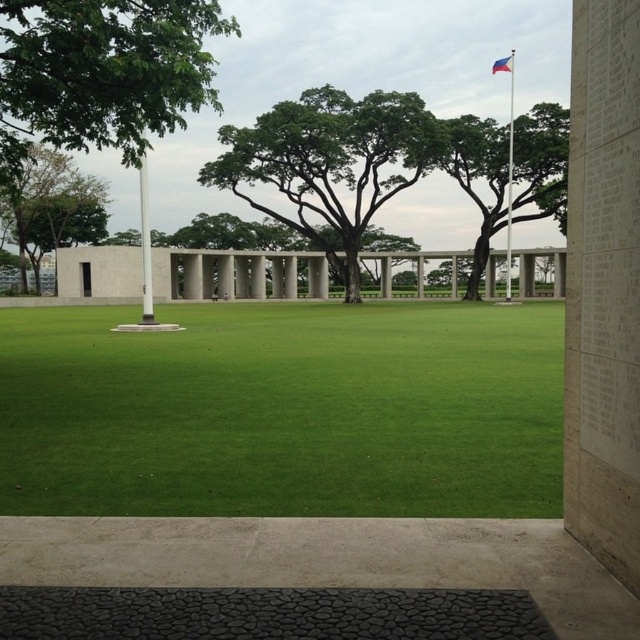
Between green grass at center and green leafy tree at upper center, which one is positioned lower?

green grass at center

Is green grass at center below green leafy tree at upper center?

Correct, green grass at center is located below green leafy tree at upper center.

Which is in front, point (83, 442) or point (550, 144)?

Point (83, 442) is in front.

Where is `green grass at center`? Image resolution: width=640 pixels, height=640 pixels. green grass at center is located at coordinates (284, 410).

What are the coordinates of `white metallic flag pole at upper right` in the screenshot? It's located at [509, 176].

Between point (509, 88) and point (509, 70), which one is positioned in front?

Point (509, 70) is in front.

What do you see at coordinates (509, 176) in the screenshot?
I see `white metallic flag pole at upper right` at bounding box center [509, 176].

Identify the location of white metallic flag pole at upper right. (509, 176).

Does white stone wall at right appear on the right side of green leafy tree at left?

Correct, you'll find white stone wall at right to the right of green leafy tree at left.

Is point (588, 150) positioned before point (33, 150)?

Yes, it is in front of point (33, 150).

Does point (588, 131) come behind point (51, 221)?

No, it is not.

Where is `white stone wall at right`? The height and width of the screenshot is (640, 640). white stone wall at right is located at coordinates (604, 288).